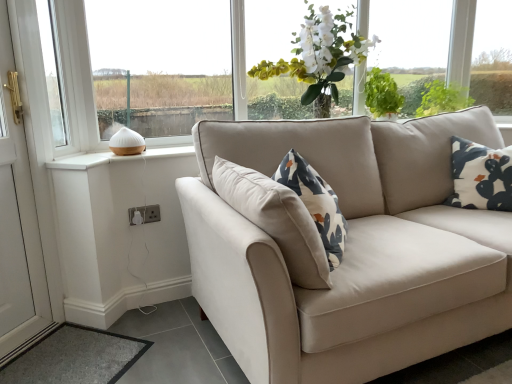
Where is `blank space situated above gray carpet at lower left (from a real-world perspective)`? The width and height of the screenshot is (512, 384). blank space situated above gray carpet at lower left (from a real-world perspective) is located at coordinates (71, 355).